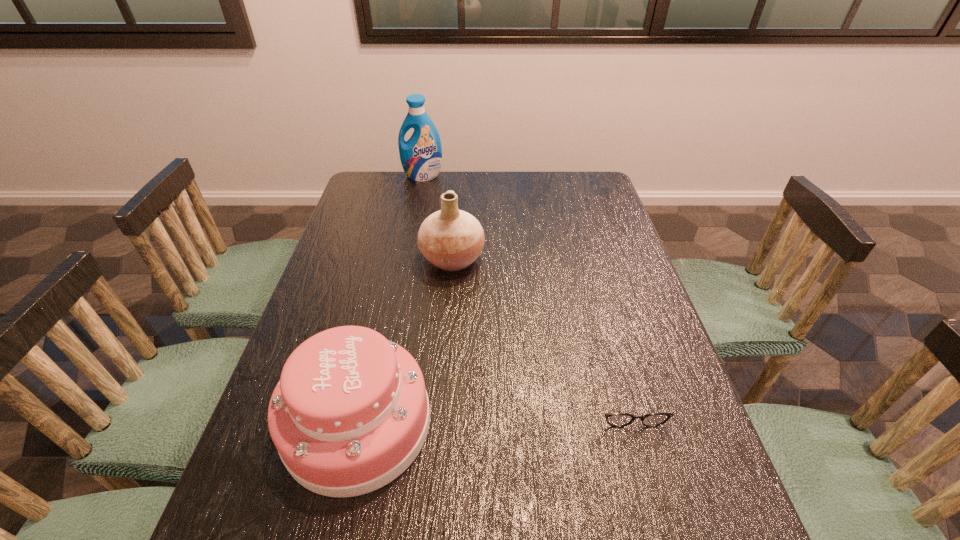
Where is `free point between the cake and the spectacles`? free point between the cake and the spectacles is located at coordinates (492, 410).

Locate an element on the screen. free space between the tallest object and the rightmost object is located at coordinates (524, 286).

Find the location of a particular element. The width and height of the screenshot is (960, 540). empty space that is in between the cake and the tallest object is located at coordinates (391, 300).

Locate an element on the screen. The width and height of the screenshot is (960, 540). vacant space in between the pottery and the cake is located at coordinates (405, 341).

Where is `object that is the third closest to the second farthest object`? object that is the third closest to the second farthest object is located at coordinates (613, 419).

Identify which object is the second nearest to the detergent. Please provide its 2D coordinates. Your answer should be formatted as a tuple, i.e. [(x, y)], where the tuple contains the x and y coordinates of a point satisfying the conditions above.

[(350, 413)]

Find the location of `vacant region that satisfies the following two spatial constraints: 1. to pour from the handle of the pottery; 2. on the front side of the cake`. vacant region that satisfies the following two spatial constraints: 1. to pour from the handle of the pottery; 2. on the front side of the cake is located at coordinates (440, 423).

Find the location of a particular element. free region that satisfies the following two spatial constraints: 1. to pour from the handle of the second farthest object; 2. on the front side of the cake is located at coordinates (440, 423).